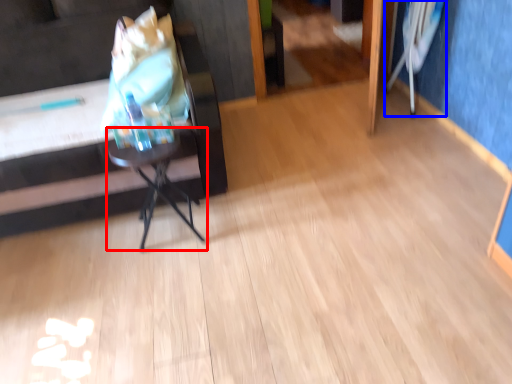
Question: Which point is closer to the camera, table (highlighted by a red box) or swivel chair (highlighted by a blue box)?

Choices:
 (A) table
 (B) swivel chair

Answer: (A)